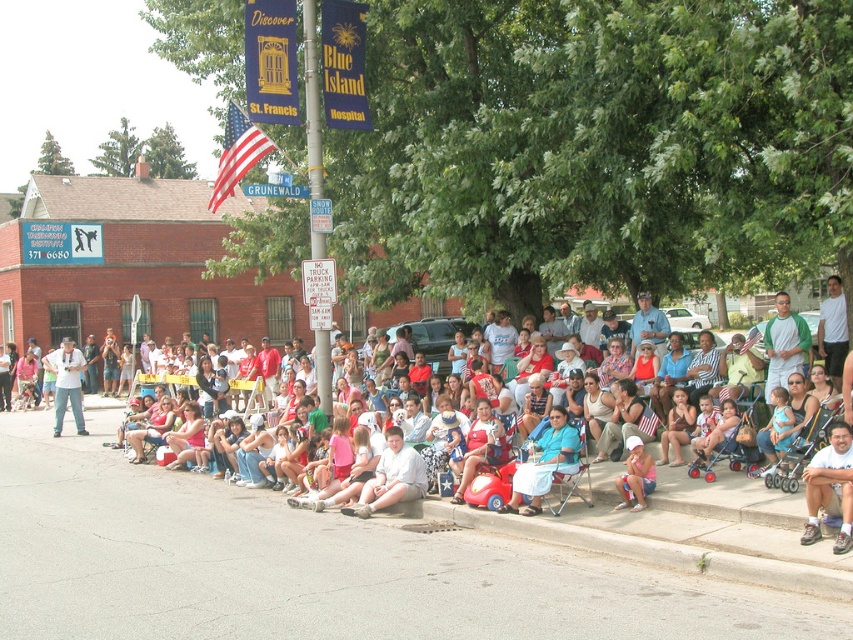
You are organizing a photo shoot and need to ensure that two models wearing the matte white shirt at center and the white cotton dress at center can stand side by side without overlapping. Given that the space available is exactly the same as the width of the wider of the two garments, which garment should you place closer to the edge to maximize space?

The matte white shirt at center is wider than the white cotton dress at center, so placing the matte white shirt at center closer to the edge will allow the white cotton dress at center to fit within the available space without overlapping.

You are a photographer at the event and want to capture the American flag in the background. You notice a person wearing a matte white shirt at center. Where is the point at coordinate (171, 512) located on the person?

The point at coordinate (171, 512) is located on the matte white shirt at center.

You are a photographer at the event and want to capture a photo of the pink fabric dress at lower center without the matte red car at center blocking it. How should you adjust your position?

Move behind the pink fabric dress at lower center so that it is no longer behind the matte red car at center, allowing the photographer to capture it without obstruction.